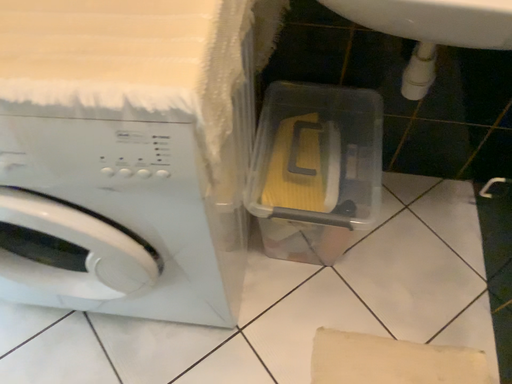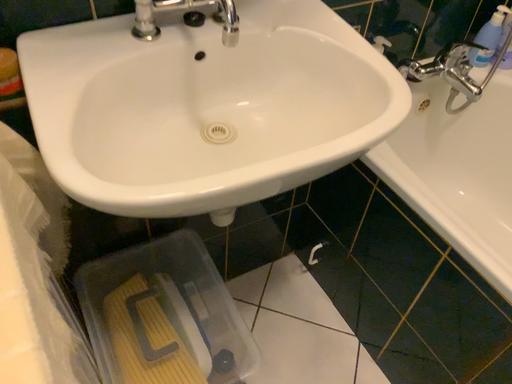
Question: Which way did the camera rotate in the video?

Choices:
 (A) rotated right
 (B) rotated left

Answer: (A)